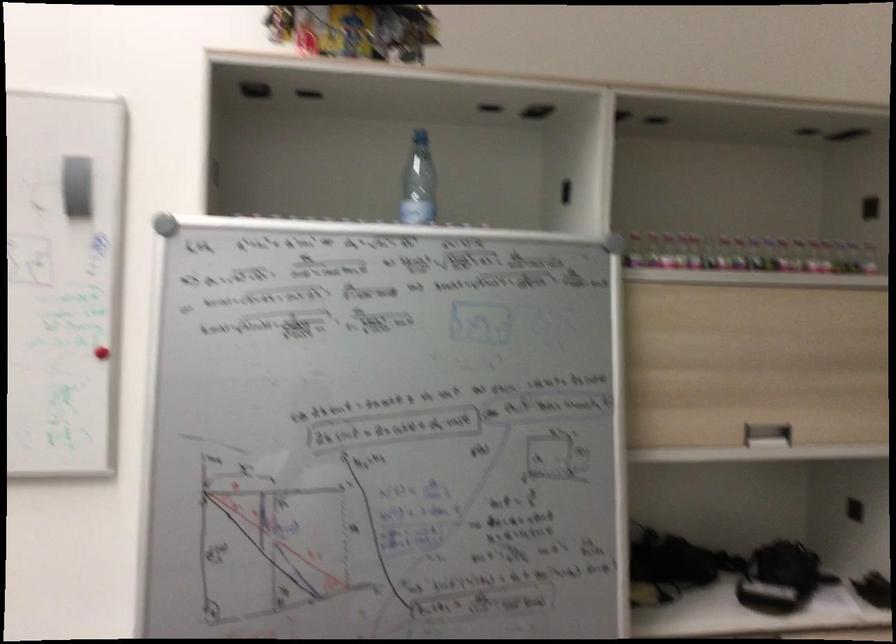
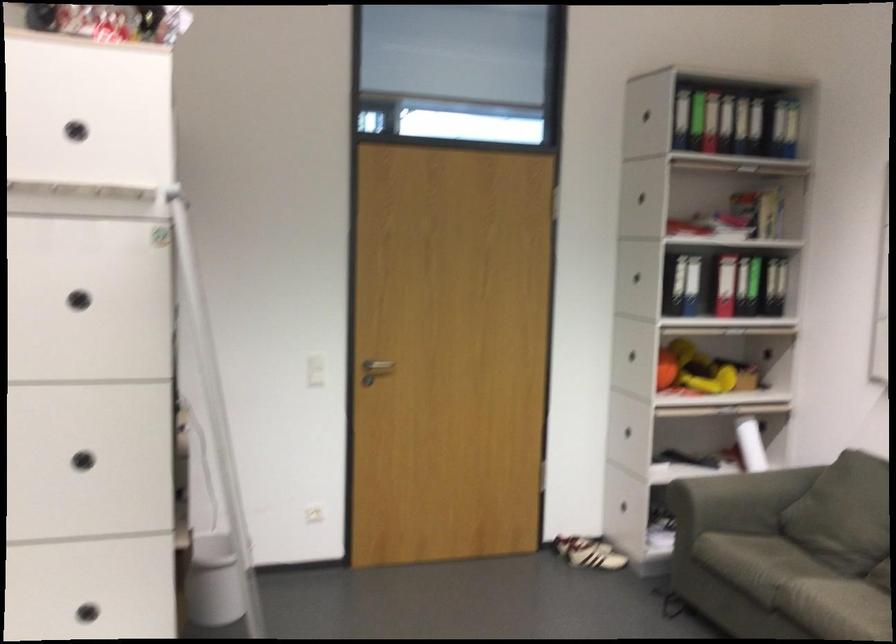
Find the pixel in the second image that matches (x=226, y=366) in the first image.

(80, 288)